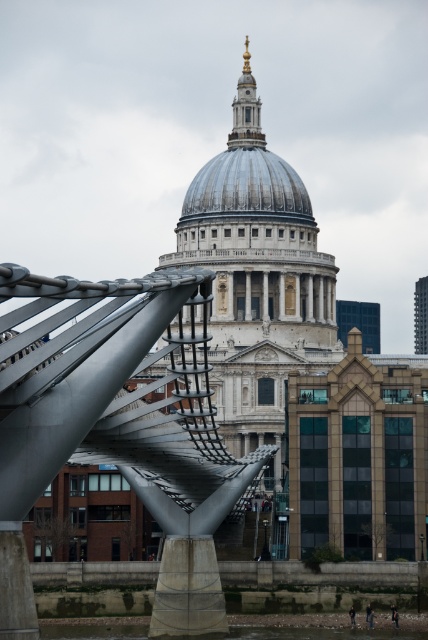
You are standing at the Millennium Bridge and see two points marked in the image. The first point is at coordinates point (x=20, y=413) and the second is at point (x=264, y=179). Which point is closer to you?

Point (x=20, y=413) is closer to the viewer than point (x=264, y=179).

You are standing on the Millennium Bridge and want to take a photo of St. Paul Cathedral. Where should you position yourself to ensure the metallic gray bridge at center is in the foreground of your photo?

Position yourself on the metallic gray bridge at center to capture St. Paul Cathedral in the background with the bridge as the foreground.

You are a tourist standing on the metallic gray bridge at center and want to take a photo of the shiny silver dome at center. If your camera has a maximum zoom range that can capture objects up to 30 meters away, will you be able to take a clear photo of the dome without moving closer?

The metallic gray bridge at center and shiny silver dome at center are 34.20 meters apart from each other. Since the distance exceeds the camera maximum zoom range of 30 meters, the tourist will not be able to take a clear photo of the shiny silver dome at center without moving closer.